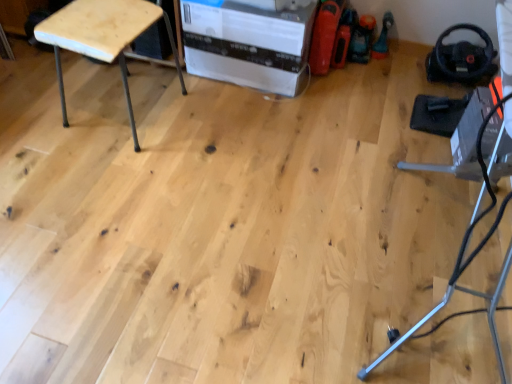
Where is `natural wood stool at upper left`? natural wood stool at upper left is located at coordinates (103, 37).

Describe the element at coordinates (103, 37) in the screenshot. I see `natural wood stool at upper left` at that location.

What are the coordinates of `white cardboard box at center` in the screenshot? It's located at (247, 44).

The width and height of the screenshot is (512, 384). What do you see at coordinates (247, 44) in the screenshot? I see `white cardboard box at center` at bounding box center [247, 44].

The image size is (512, 384). Identify the location of natural wood stool at upper left. pos(103,37).

Does white cardboard box at center appear on the right side of natural wood stool at upper left?

Correct, you'll find white cardboard box at center to the right of natural wood stool at upper left.

Is white cardboard box at center positioned in front of natural wood stool at upper left?

No, white cardboard box at center is further to the viewer.

Considering the points (195, 1) and (58, 36), which point is in front, point (195, 1) or point (58, 36)?

The point (58, 36) is more forward.

From the image's perspective, would you say white cardboard box at center is shown under natural wood stool at upper left?

Incorrect, from the image's perspective, white cardboard box at center is higher than natural wood stool at upper left.

From a real-world perspective, which is physically below, white cardboard box at center or natural wood stool at upper left?

white cardboard box at center.

Considering the relative sizes of white cardboard box at center and natural wood stool at upper left in the image provided, is white cardboard box at center wider than natural wood stool at upper left?

Yes, white cardboard box at center is wider than natural wood stool at upper left.

Which of these two, white cardboard box at center or natural wood stool at upper left, stands shorter?

With less height is white cardboard box at center.

Which of these two, white cardboard box at center or natural wood stool at upper left, is smaller?

natural wood stool at upper left.

Is white cardboard box at center inside the boundaries of natural wood stool at upper left, or outside?

white cardboard box at center is located beyond the bounds of natural wood stool at upper left.

Is white cardboard box at center in contact with natural wood stool at upper left?

There is a gap between white cardboard box at center and natural wood stool at upper left.

Is white cardboard box at center turned away from natural wood stool at upper left?

No, white cardboard box at center is not facing away from natural wood stool at upper left.

What's the angular difference between white cardboard box at center and natural wood stool at upper left's facing directions?

They differ by 4.73 degrees in their facing directions.

You are a GUI agent. You are given a task and a screenshot of the screen. Output one action in this format:
    pyautogui.click(x=<x>, y=<y>)
    Task: Click on the furniture located on the left of white cardboard box at center
    Image resolution: width=512 pixels, height=384 pixels.
    Given the screenshot: What is the action you would take?
    pyautogui.click(x=103, y=37)

Between natural wood stool at upper left and white cardboard box at center, which one appears on the right side from the viewer's perspective?

white cardboard box at center is more to the right.

In the image, is natural wood stool at upper left positioned in front of or behind white cardboard box at center?

natural wood stool at upper left is positioned closer to the viewer than white cardboard box at center.

Which is behind, point (142, 2) or point (305, 82)?

The point (305, 82) is behind.

From the image's perspective, between natural wood stool at upper left and white cardboard box at center, who is located below?

natural wood stool at upper left, from the image's perspective.

From a real-world perspective, which is physically below, natural wood stool at upper left or white cardboard box at center?

From a 3D spatial view, white cardboard box at center is below.

Is natural wood stool at upper left wider or thinner than white cardboard box at center?

natural wood stool at upper left is thinner than white cardboard box at center.

Is natural wood stool at upper left shorter than white cardboard box at center?

No.

Who is bigger, natural wood stool at upper left or white cardboard box at center?

With larger size is white cardboard box at center.

Is white cardboard box at center located within natural wood stool at upper left?

Definitely not — white cardboard box at center is not inside natural wood stool at upper left.

Is natural wood stool at upper left next to white cardboard box at center and touching it?

No, natural wood stool at upper left is not in contact with white cardboard box at center.

Is natural wood stool at upper left turned away from white cardboard box at center?

natural wood stool at upper left does not have its back to white cardboard box at center.

Locate an element on the screen. This screenshot has height=384, width=512. cardboard box lying above the natural wood stool at upper left (from the image's perspective) is located at coordinates (247, 44).

Locate an element on the screen. This screenshot has width=512, height=384. furniture that is above the white cardboard box at center (from a real-world perspective) is located at coordinates (103, 37).

Identify the location of cardboard box that is under the natural wood stool at upper left (from a real-world perspective). (247, 44).